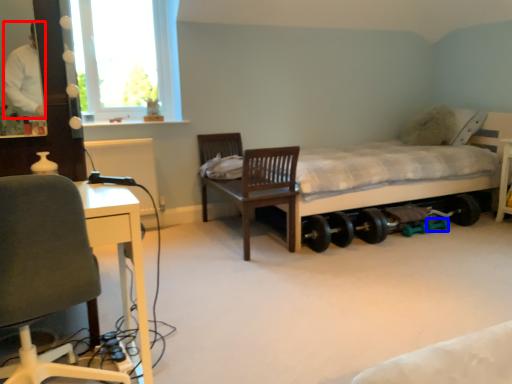
Question: Which object appears farthest to the camera in this image, person (highlighted by a red box) or wheel (highlighted by a blue box)?

Choices:
 (A) person
 (B) wheel

Answer: (B)